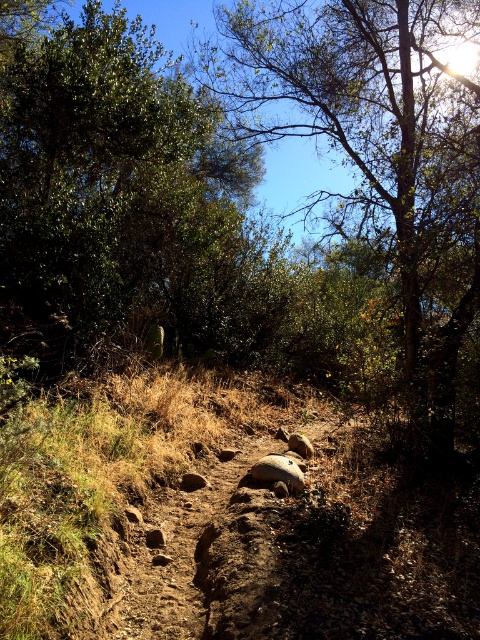
You are a hiker walking along the dirt path in the woods. You come across two points marked on your map at coordinates point (206, 248) and point (475, 221). According to the map, which point is further along the path in the direction you are walking?

Point (206, 248) is behind point (475, 221), so if you are walking forward, point (475, 221) is ahead of you and further along the path.

You are a hiker standing at the start of the dirt path. You notice two trees ahead on your path. The first is the green leafy tree at upper left, and the second is the green leafy tree at center. Which tree would you reach first as you walk along the path?

The green leafy tree at upper left is shorter than the green leafy tree at center, but since it is positioned at the upper left, you would reach it first as you walk along the dirt path.

You are a hiker planning to walk along the dirt path in the wooded area. You notice two green leafy trees ahead. Which tree, the green leafy tree at upper left or the green leafy tree at center, would you estimate to be narrower?

The green leafy tree at upper left has a lesser width compared to the green leafy tree at center, so the green leafy tree at upper left is narrower.